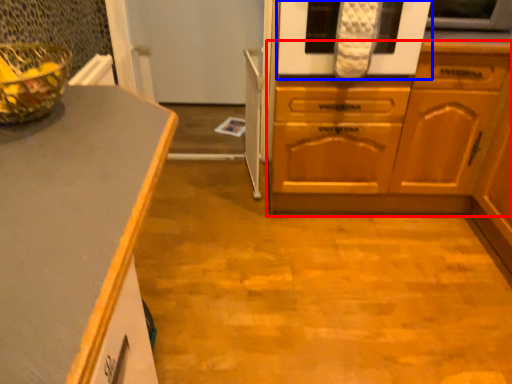
Question: Among these objects, which one is nearest to the camera, cabinetry (highlighted by a red box) or oven (highlighted by a blue box)?

Choices:
 (A) cabinetry
 (B) oven

Answer: (A)